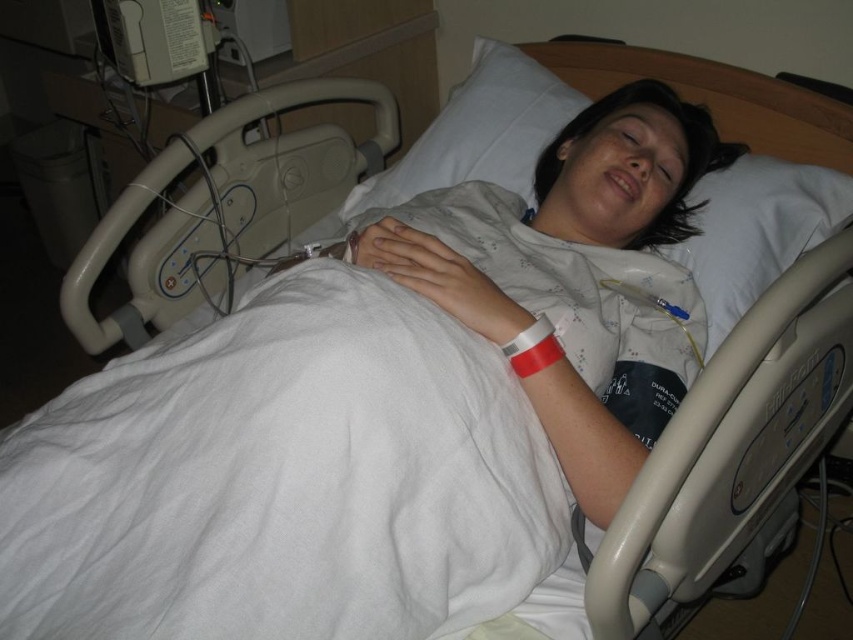
Question: Which point is closer to the camera?

Choices:
 (A) (531, 339)
 (B) (566, 108)
 (C) (459, 284)

Answer: (A)

Question: Is white fabric pillow at upper center further to the viewer compared to red matte wristband at center?

Choices:
 (A) yes
 (B) no

Answer: (A)

Question: Is white fabric pillow at upper center wider than red matte wristband at center?

Choices:
 (A) no
 (B) yes

Answer: (B)

Question: Does white fabric pillow at upper center appear under red matte wristband at center?

Choices:
 (A) no
 (B) yes

Answer: (A)

Question: Which of the following is the closest to the observer?

Choices:
 (A) (463, 97)
 (B) (592, 483)

Answer: (B)

Question: Which object is positioned farthest from the white fabric pillow at upper center?

Choices:
 (A) white matte wristband at center
 (B) red matte wristband at center

Answer: (B)